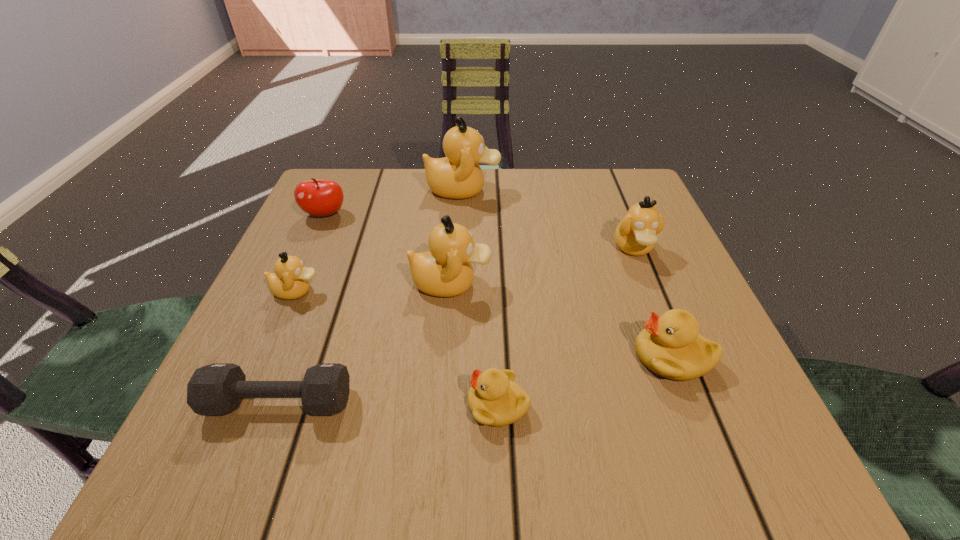
I want to click on vacant region located on the face of the leftmost tan duckling, so click(474, 291).

Identify the location of free space located 0.290m on the front-facing side of the shortest duckling. (266, 404).

The image size is (960, 540). I want to click on free space located on the front-facing side of the shortest duckling, so click(x=377, y=404).

The image size is (960, 540). What are the coordinates of `free point located 0.130m on the front-facing side of the shortest duckling` in the screenshot? It's located at (377, 404).

You are a GUI agent. You are given a task and a screenshot of the screen. Output one action in this format:
    pyautogui.click(x=<x>, y=<y>)
    Task: Click on the vacant space located 0.140m on the back of the dumbbell
    The image size is (960, 540).
    Given the screenshot: What is the action you would take?
    pyautogui.click(x=312, y=313)

In order to click on duckling located at the far edge in this screenshot , I will do `click(458, 175)`.

You are a GUI agent. You are given a task and a screenshot of the screen. Output one action in this format:
    pyautogui.click(x=<x>, y=<y>)
    Task: Click on the apple positioned at the far edge
    
    Given the screenshot: What is the action you would take?
    pos(315,197)

The width and height of the screenshot is (960, 540). I want to click on duckling present at the near edge, so click(x=494, y=399).

At what (x,y) coordinates should I click in order to perform the action: click on dumbbell situated at the near edge. Please return your answer as a coordinate pair (x, y). The height and width of the screenshot is (540, 960). Looking at the image, I should click on (214, 390).

Identify the location of apple that is at the left edge. Image resolution: width=960 pixels, height=540 pixels. (315, 197).